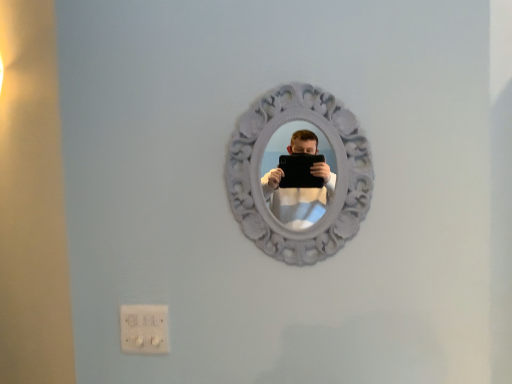
Question: From the image's perspective, is white carved mirror at center located above or below white plastic electric outlet at lower left?

Choices:
 (A) below
 (B) above

Answer: (B)

Question: Considering the positions of point (258, 223) and point (161, 347), is point (258, 223) closer or farther from the camera than point (161, 347)?

Choices:
 (A) closer
 (B) farther

Answer: (A)

Question: Considering the relative positions of white carved mirror at center and white plastic electric outlet at lower left in the image provided, is white carved mirror at center to the left or to the right of white plastic electric outlet at lower left?

Choices:
 (A) left
 (B) right

Answer: (B)

Question: Is white plastic electric outlet at lower left wider or thinner than white carved mirror at center?

Choices:
 (A) wide
 (B) thin

Answer: (B)

Question: Considering the positions of white plastic electric outlet at lower left and white carved mirror at center in the image, is white plastic electric outlet at lower left bigger or smaller than white carved mirror at center?

Choices:
 (A) big
 (B) small

Answer: (B)

Question: Considering the positions of white plastic electric outlet at lower left and white carved mirror at center in the image, is white plastic electric outlet at lower left taller or shorter than white carved mirror at center?

Choices:
 (A) tall
 (B) short

Answer: (B)

Question: From a real-world perspective, is white plastic electric outlet at lower left positioned above or below white carved mirror at center?

Choices:
 (A) below
 (B) above

Answer: (A)